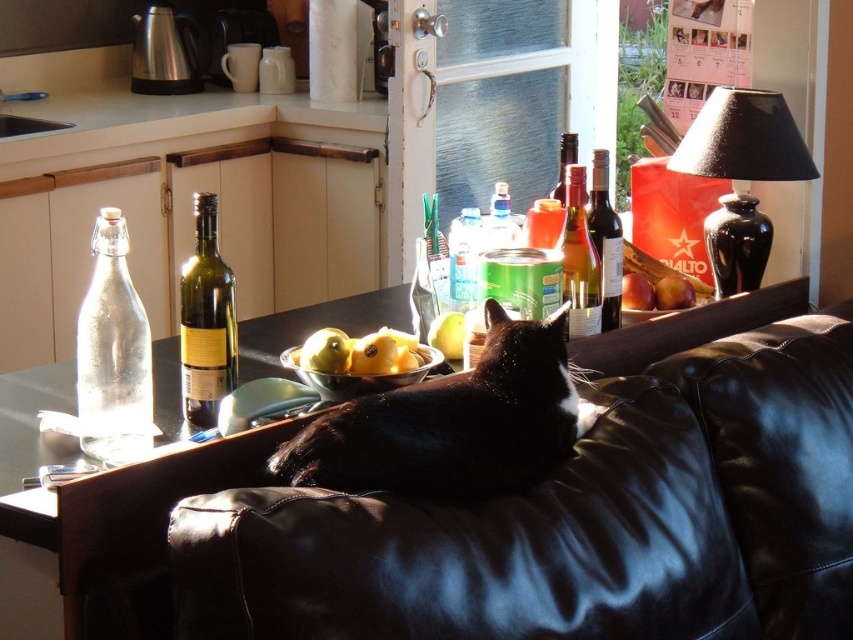
You are a delivery robot with a package that needs to be placed between the transparent glass bottle at left and the yellow matte pear at center. The package is 20 inches long. Will it fit in the space between them?

The transparent glass bottle at left and yellow matte pear at center are 23.67 inches apart from each other. The package is 20 inches long, so it will fit between them with approximately 3.67 inches of space remaining.

You are arranging fruits in the kitchen and see the smooth red apples at center and the red matte apple at couch top. Which fruit is placed above the other?

The red matte apple at couch top is placed above the smooth red apples at center because the smooth red apples at center are positioned under it.

You are a delivery person who needs to place a small package between the translucent glass can at center and the translucent glass bottle at center. Is there enough space to fit it?

The distance between the translucent glass can at center and the translucent glass bottle at center is 2.57 inches. If the small package is narrower than 2.57 inches, it can fit between them.